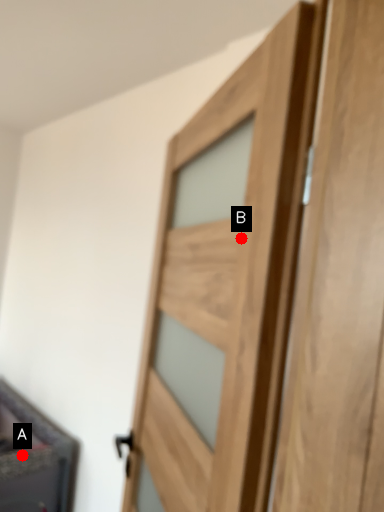
Question: Two points are circled on the image, labeled by A and B beside each circle. Which of the following is the closest to the observer?

Choices:
 (A) A is closer
 (B) B is closer

Answer: (B)